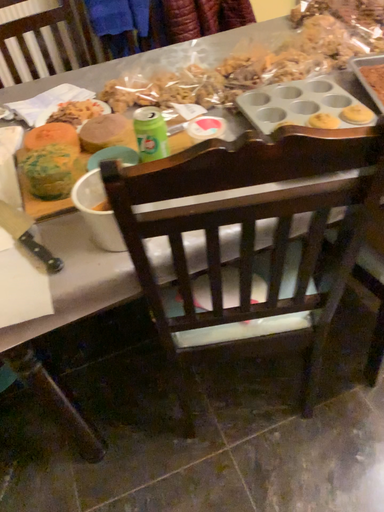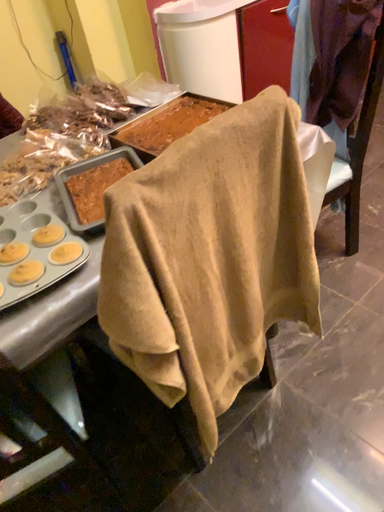
Question: How did the camera likely rotate when shooting the video?

Choices:
 (A) rotated upward
 (B) rotated downward

Answer: (A)